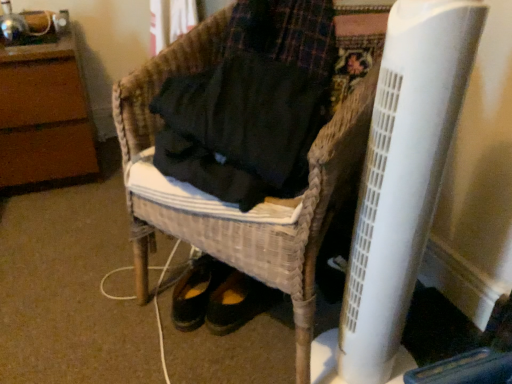
The height and width of the screenshot is (384, 512). I want to click on free spot to the left of woven wicker chair at center, which appears as the 1th furniture when viewed from the right, so click(x=89, y=286).